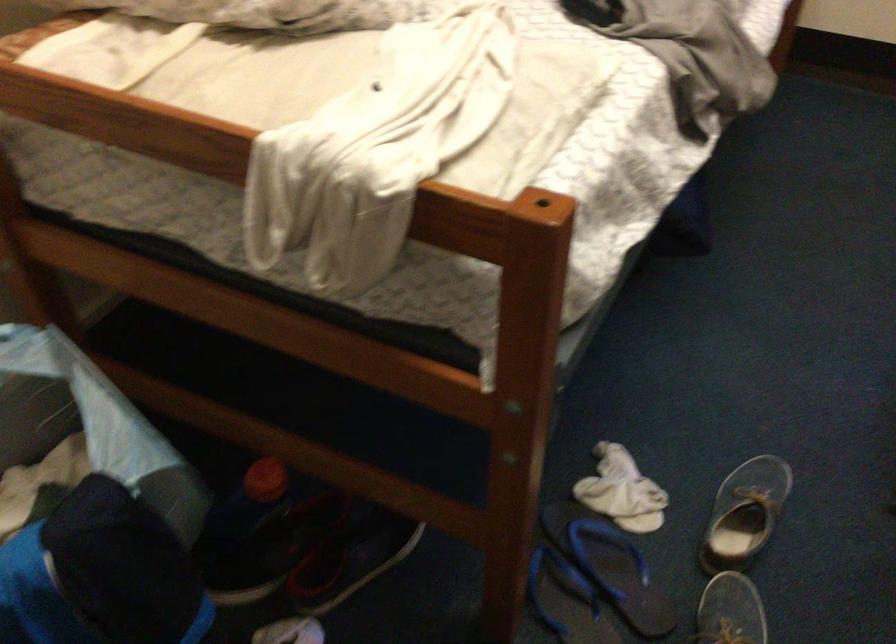
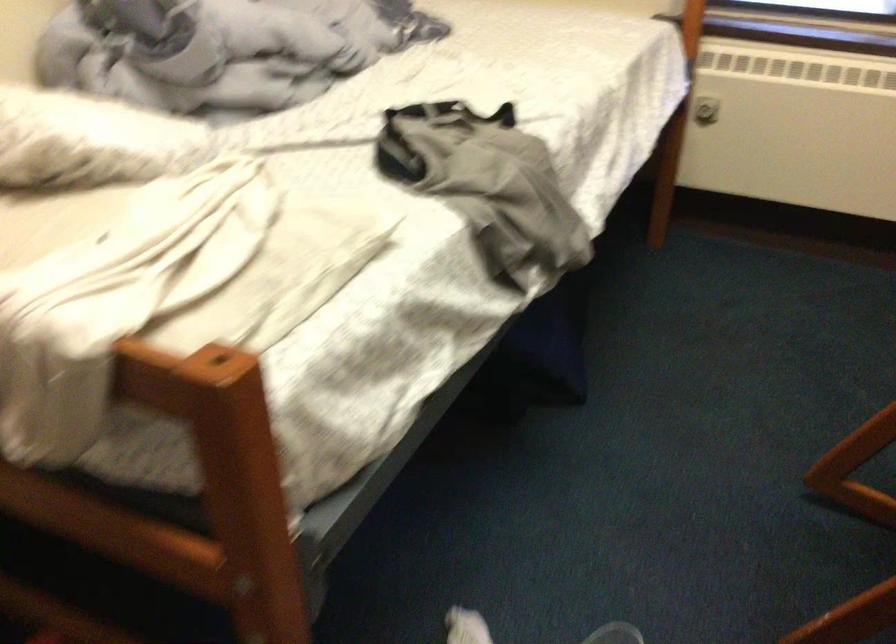
Question: Based on the continuous images, in which direction is the camera rotating? Reply with the corresponding letter.

Choices:
 (A) Left
 (B) Right
 (C) Up
 (D) Down

Answer: (C)